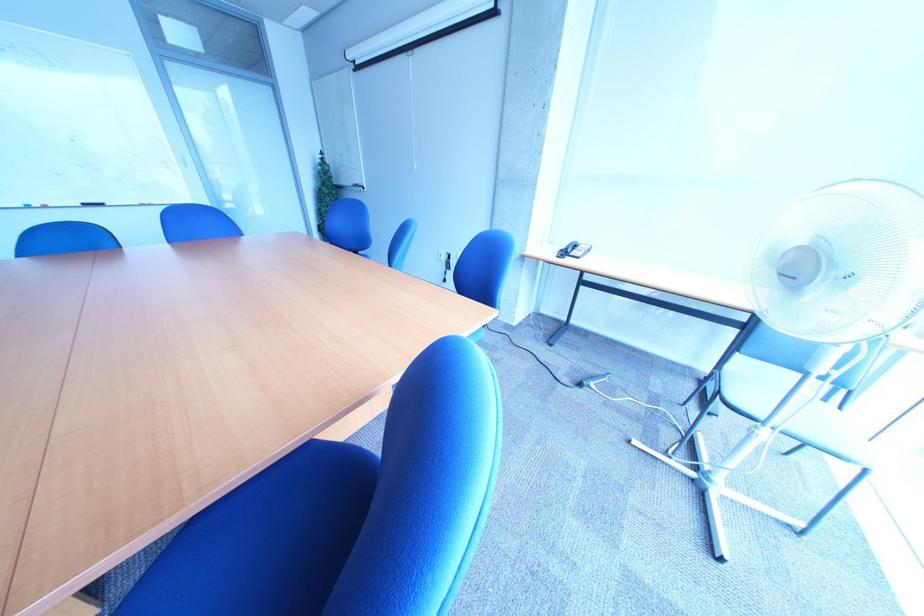
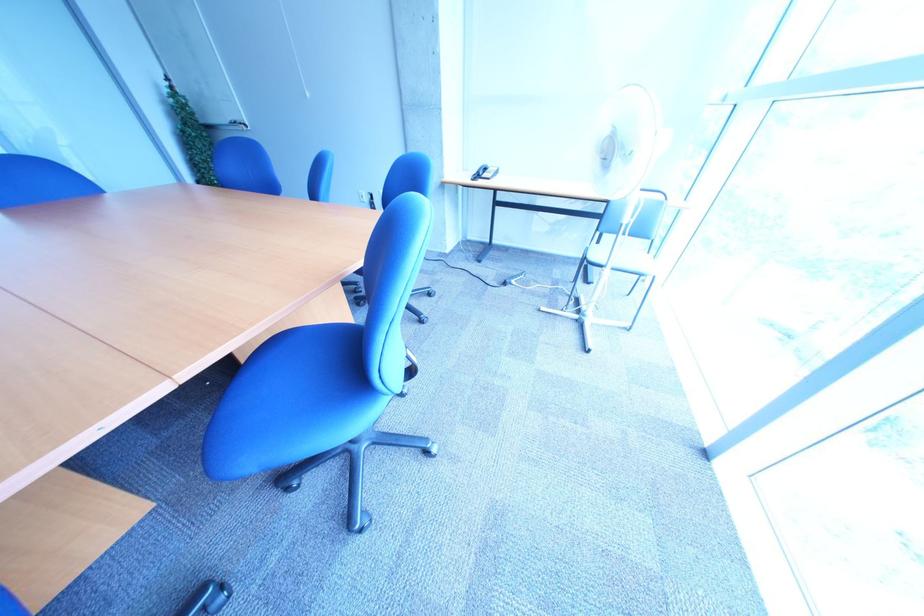
Question: Which direction would the cameraman need to move to produce the second image? Reply with the corresponding letter.

Choices:
 (A) Left
 (B) Right
 (C) Forward
 (D) Backward

Answer: (D)